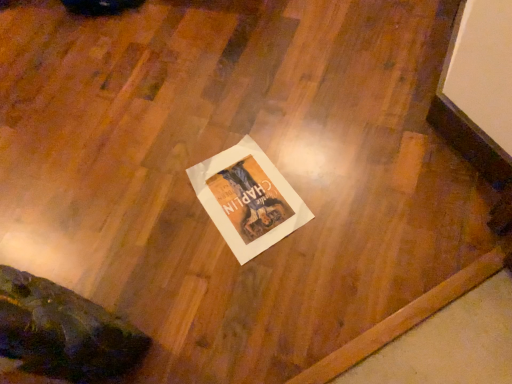
Image resolution: width=512 pixels, height=384 pixels. Describe the element at coordinates (248, 199) in the screenshot. I see `white paper poster at center` at that location.

This screenshot has height=384, width=512. Find the location of `white paper poster at center`. white paper poster at center is located at coordinates (248, 199).

This screenshot has width=512, height=384. Identify the location of white paper poster at center. (248, 199).